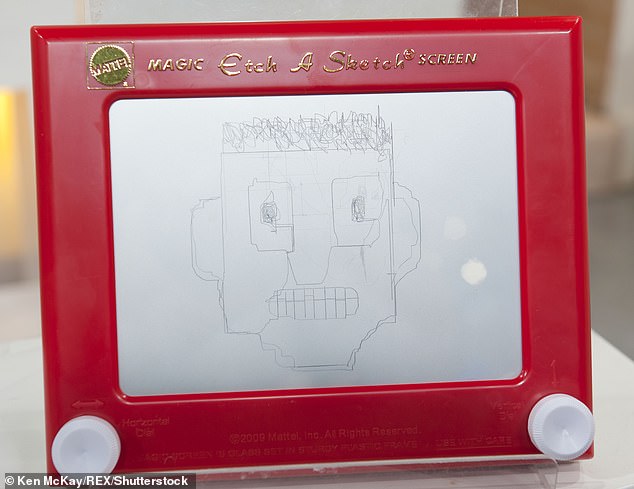
Where is `left knob`? This screenshot has height=489, width=634. left knob is located at coordinates (87, 445).